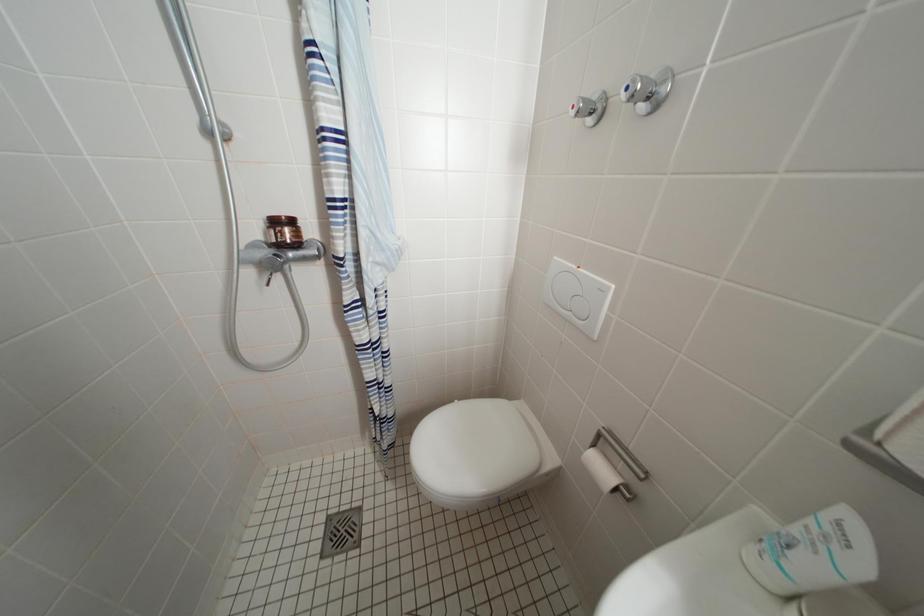
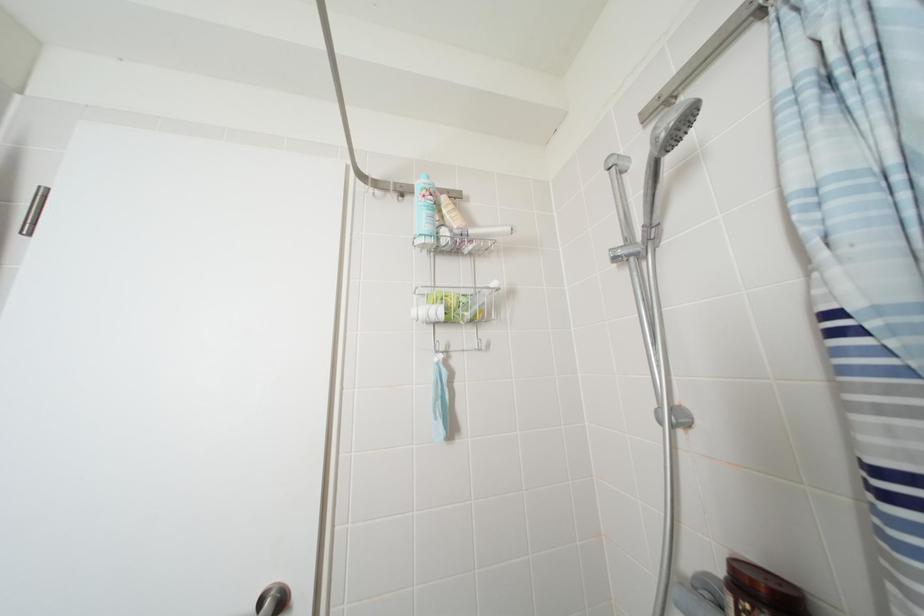
Question: Based on the continuous images, in which direction is the camera rotating? Reply with the corresponding letter.

Choices:
 (A) Left
 (B) Right
 (C) Up
 (D) Down

Answer: (A)